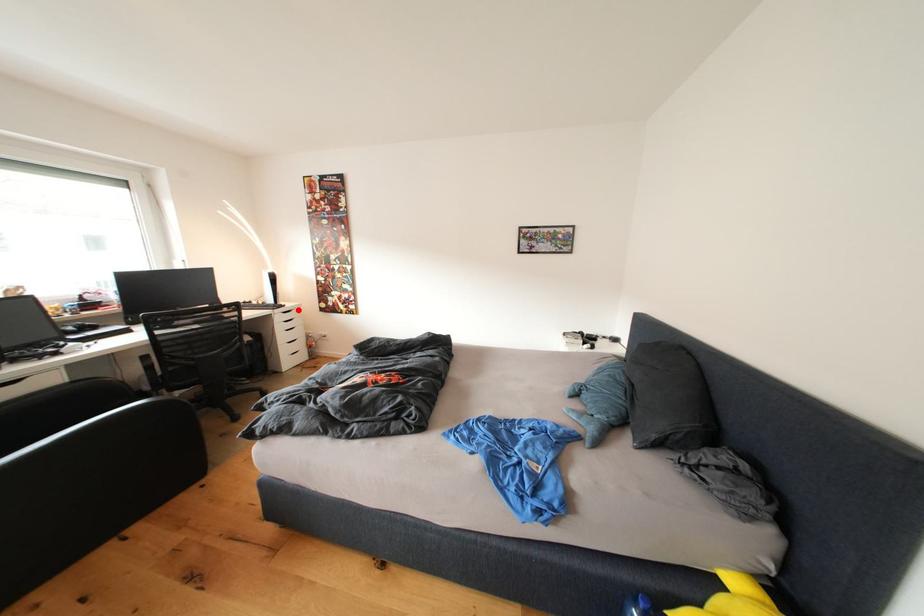
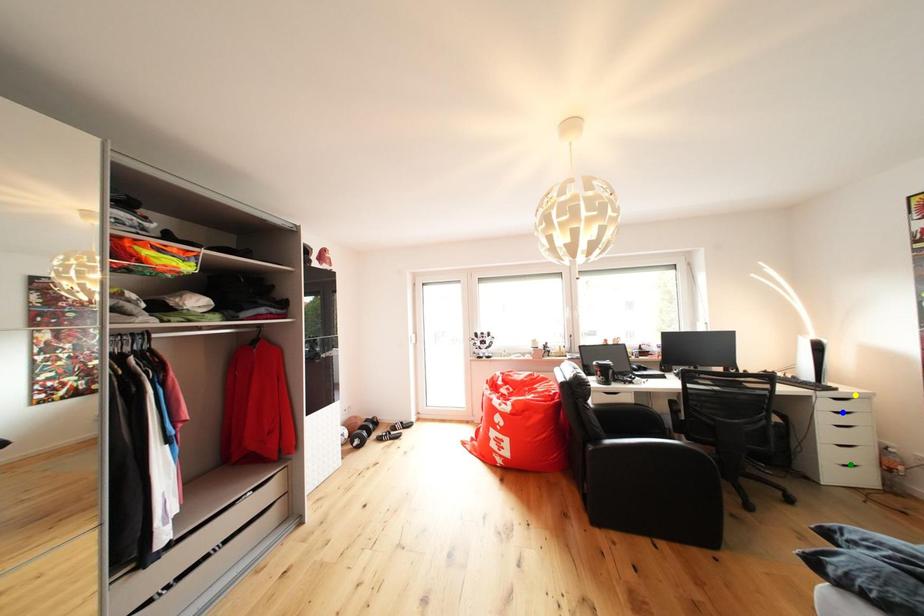
Question: I am providing you with two images of the same scene from different viewpoints. A red point is marked on the first image. You are given multiple points on the second image. In image 2, which mark is for the same physical point as the one in image 1?

Choices:
 (A) blue point
 (B) green point
 (C) yellow point

Answer: (C)